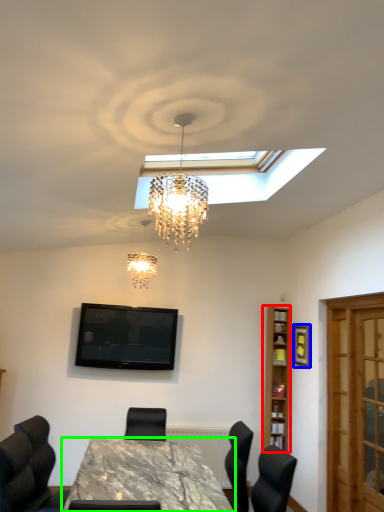
Question: Which is nearer to the bookshelf (highlighted by a red box)? picture frame (highlighted by a blue box) or table (highlighted by a green box).

Choices:
 (A) picture frame
 (B) table

Answer: (A)